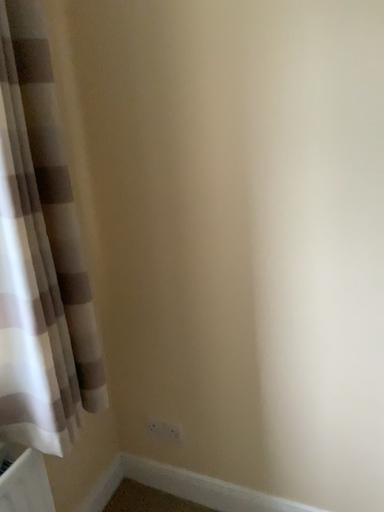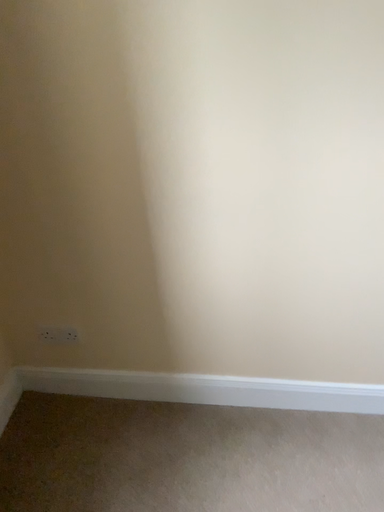
Question: Which way did the camera rotate in the video?

Choices:
 (A) rotated downward
 (B) rotated upward

Answer: (A)